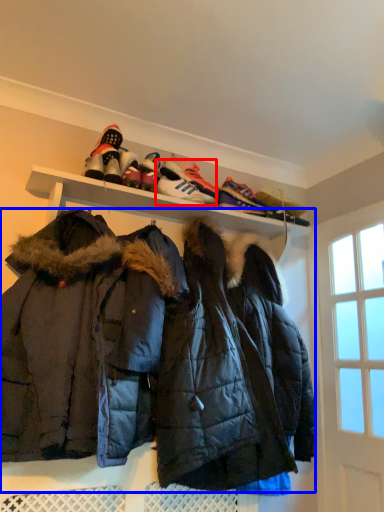
Question: Which object is further to the camera taking this photo, footwear (highlighted by a red box) or jacket (highlighted by a blue box)?

Choices:
 (A) footwear
 (B) jacket

Answer: (A)